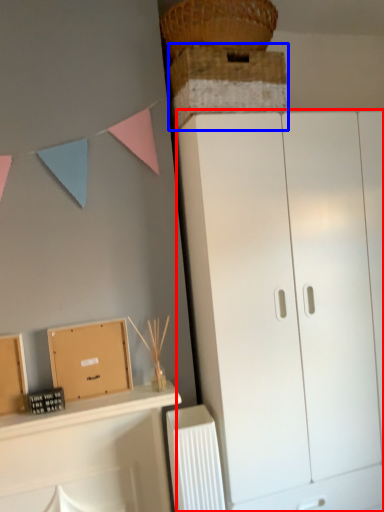
Question: Which of the following is the closest to the observer, cupboard (highlighted by a red box) or cabinetry (highlighted by a blue box)?

Choices:
 (A) cupboard
 (B) cabinetry

Answer: (B)